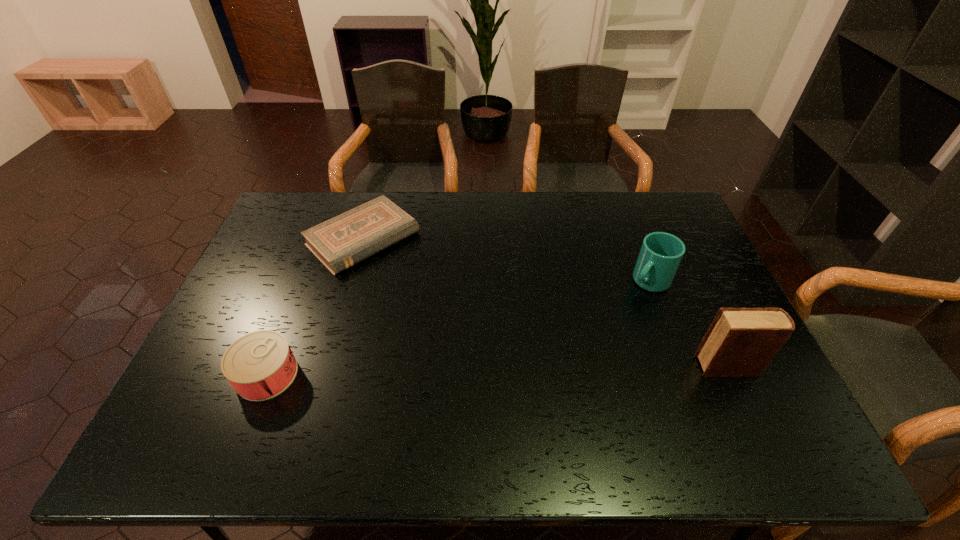
Where is `empty location between the third shortest object and the diary`? The width and height of the screenshot is (960, 540). empty location between the third shortest object and the diary is located at coordinates (688, 323).

Locate an element on the screen. The height and width of the screenshot is (540, 960). free space between the tallest object and the cup is located at coordinates (688, 323).

Where is `vacant space that is in between the third shortest object and the shortest object`? The width and height of the screenshot is (960, 540). vacant space that is in between the third shortest object and the shortest object is located at coordinates (506, 260).

You are a GUI agent. You are given a task and a screenshot of the screen. Output one action in this format:
    pyautogui.click(x=<x>, y=<y>)
    Task: Click on the vacant space in between the can and the second tallest object
    The image size is (960, 540).
    Given the screenshot: What is the action you would take?
    pyautogui.click(x=458, y=328)

Where is `object that is the second closest to the Bible`? The height and width of the screenshot is (540, 960). object that is the second closest to the Bible is located at coordinates (661, 253).

Identify which object is the third nearest to the can. Please provide its 2D coordinates. Your answer should be formatted as a tuple, i.e. [(x, y)], where the tuple contains the x and y coordinates of a point satisfying the conditions above.

[(740, 342)]

What are the coordinates of `free spot that satisfies the following two spatial constraints: 1. on the back side of the can; 2. on the left side of the third shortest object` in the screenshot? It's located at (303, 281).

This screenshot has height=540, width=960. Identify the location of blank area in the image that satisfies the following two spatial constraints: 1. on the back side of the third tallest object; 2. on the right side of the third shortest object. (303, 281).

Locate an element on the screen. This screenshot has height=540, width=960. vacant position in the image that satisfies the following two spatial constraints: 1. on the back side of the third tallest object; 2. on the spine side of the tallest object is located at coordinates (270, 366).

The image size is (960, 540). I want to click on vacant region that satisfies the following two spatial constraints: 1. on the front side of the third shortest object; 2. on the spine side of the diary, so click(x=682, y=366).